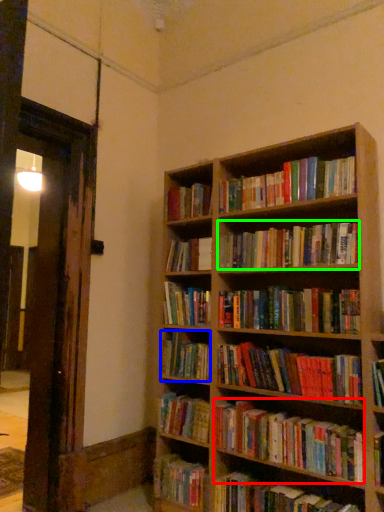
Question: Which is nearer to the book (highlighted by a red box)? book (highlighted by a blue box) or book (highlighted by a green box).

Choices:
 (A) book
 (B) book

Answer: (A)